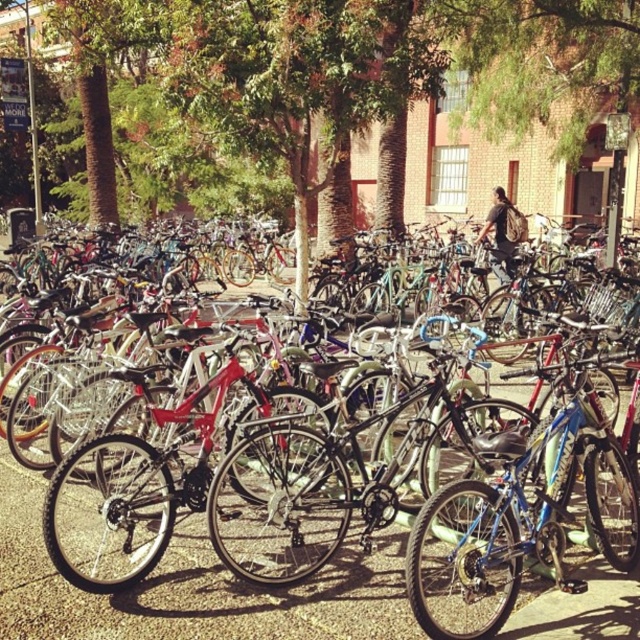
In the scene shown: Who is more distant from viewer, (x=349, y=548) or (x=592, y=509)?

The point (x=349, y=548) is behind.

Looking at this image, is shiny metallic bicycle at center below blue metallic bicycle at center?

Yes.

Which is in front, point (198, 561) or point (445, 611)?

Point (445, 611)

This screenshot has height=640, width=640. I want to click on shiny metallic bicycle at center, so click(x=192, y=588).